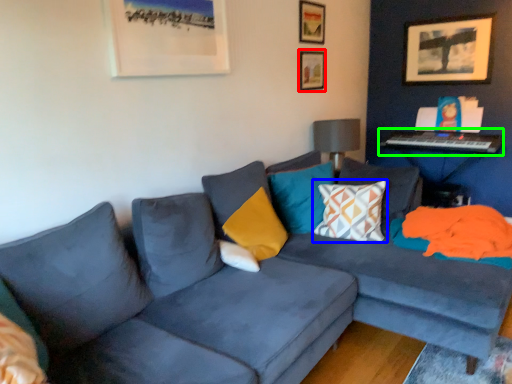
Question: Estimate the real-world distances between objects in this image. Which object is farther from picture frame (highlighted by a red box), pillow (highlighted by a blue box) or piano (highlighted by a green box)?

Choices:
 (A) pillow
 (B) piano

Answer: (A)